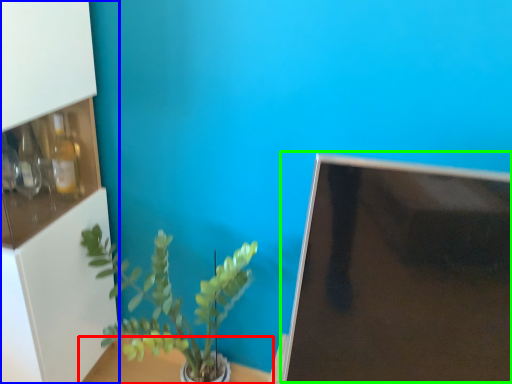
Question: Considering the real-world distances, which object is farthest from table (highlighted by a red box)? shelf (highlighted by a blue box) or computer monitor (highlighted by a green box)?

Choices:
 (A) shelf
 (B) computer monitor

Answer: (B)